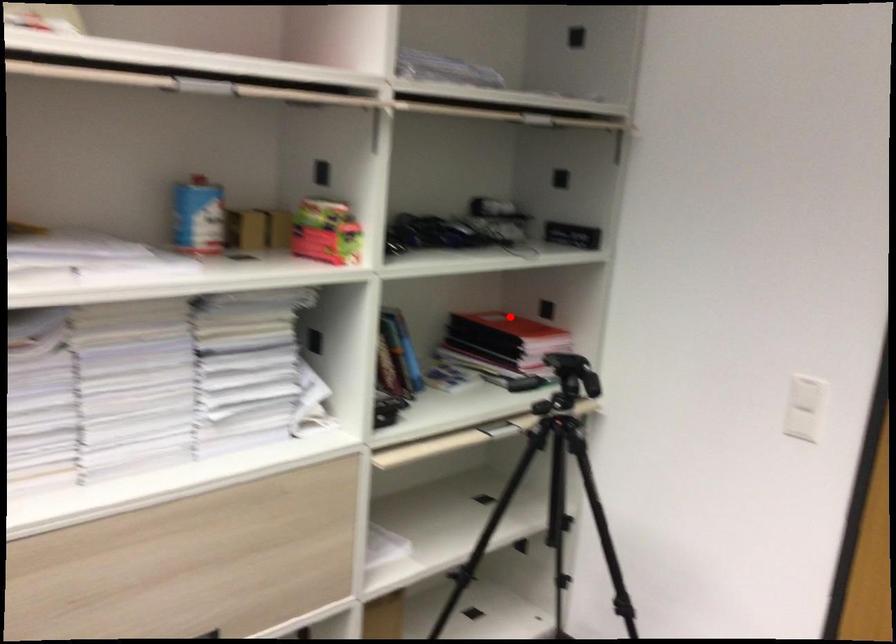
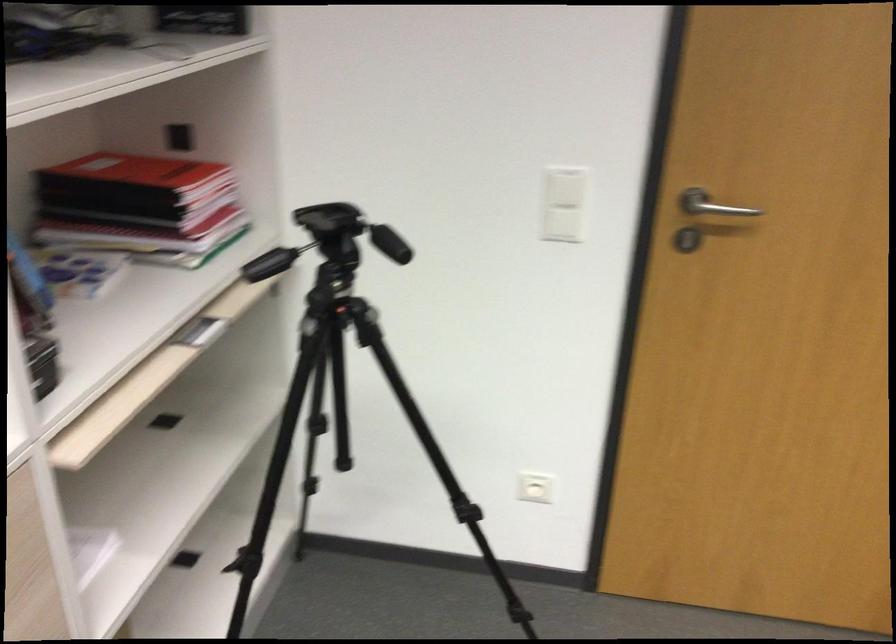
Question: I am providing you with two images of the same scene from different viewpoints. A red point is shown in image1. For the corresponding object point in image2, is it positioned nearer or farther from the camera?

Choices:
 (A) Nearer
 (B) Farther

Answer: (A)